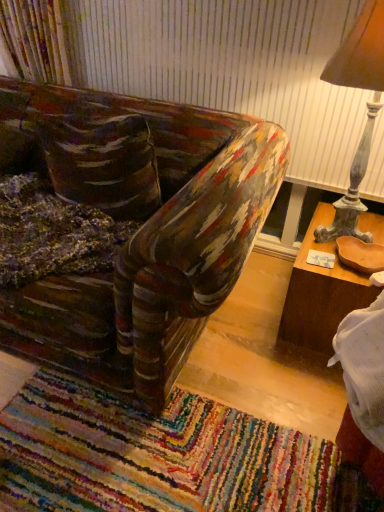
Question: From a real-world perspective, is wooden lampshade at right physically located above or below multicolored woven mat at lower center?

Choices:
 (A) above
 (B) below

Answer: (A)

Question: In terms of width, does wooden lampshade at right look wider or thinner when compared to multicolored woven mat at lower center?

Choices:
 (A) wide
 (B) thin

Answer: (B)

Question: Which object is the farthest from the multicolored woven mat at lower center?

Choices:
 (A) brown wood table at right
 (B) wooden lampshade at right

Answer: (B)

Question: Based on their relative distances, which object is farther from the multicolored woven mat at lower center?

Choices:
 (A) wooden lampshade at right
 (B) brown wood table at right

Answer: (A)